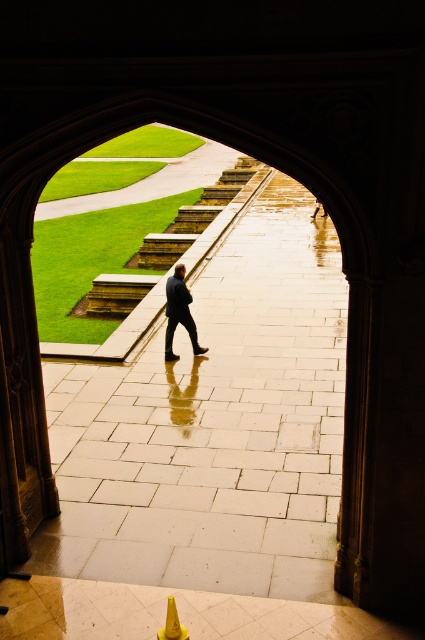
Is dark blue suit at center positioned before yellow plastic traffic cone at lower center?

No, it is behind yellow plastic traffic cone at lower center.

Is dark blue suit at center to the left of yellow plastic traffic cone at lower center from the viewer's perspective?

Yes, dark blue suit at center is to the left of yellow plastic traffic cone at lower center.

The width and height of the screenshot is (425, 640). Describe the element at coordinates (178, 312) in the screenshot. I see `dark blue suit at center` at that location.

Where is `dark blue suit at center`? This screenshot has height=640, width=425. dark blue suit at center is located at coordinates (178, 312).

Can you confirm if light gray stone pavement at center is smaller than dark blue suit at center?

Actually, light gray stone pavement at center might be larger than dark blue suit at center.

Which of these two, light gray stone pavement at center or dark blue suit at center, stands taller?

With more height is light gray stone pavement at center.

Describe the element at coordinates (215, 426) in the screenshot. The image size is (425, 640). I see `light gray stone pavement at center` at that location.

The width and height of the screenshot is (425, 640). In order to click on light gray stone pavement at center in this screenshot , I will do `click(215, 426)`.

Which is more to the right, light gray stone pavement at center or yellow plastic traffic cone at lower center?

From the viewer's perspective, light gray stone pavement at center appears more on the right side.

The image size is (425, 640). I want to click on light gray stone pavement at center, so click(215, 426).

Find the location of a particular element. The height and width of the screenshot is (640, 425). light gray stone pavement at center is located at coordinates (215, 426).